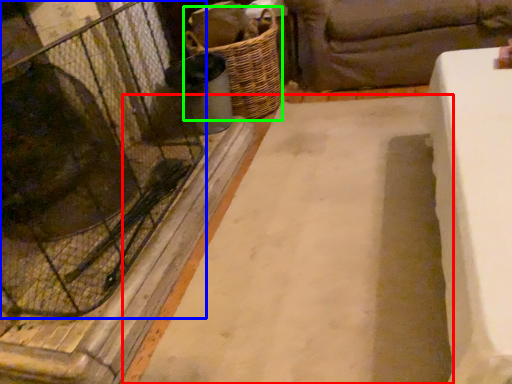
Question: Based on their relative distances, which object is farther from foundation (highlighted by a red box)? Choose from glass door (highlighted by a blue box) and basket (highlighted by a green box).

Choices:
 (A) glass door
 (B) basket

Answer: (B)